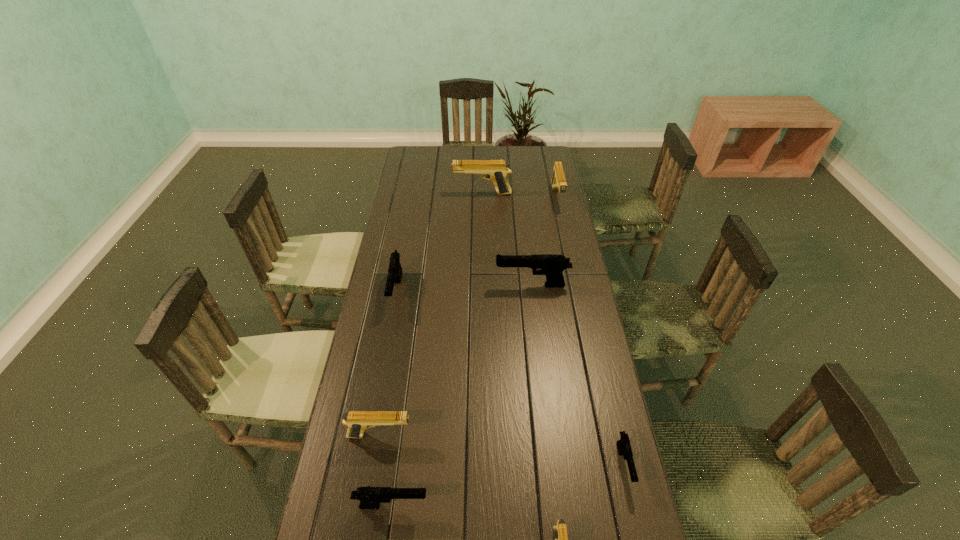
At what (x,y) coordinates should I click in order to perform the action: click on the third closest black pistol to the third tan pistol from right to left. Please return your answer as a coordinate pair (x, y). This screenshot has width=960, height=540. Looking at the image, I should click on (624, 447).

Find the location of a particular element. The width and height of the screenshot is (960, 540). vacant point that satisfies the following two spatial constraints: 1. at the barrel of the second object from right to left; 2. on the front-facing side of the biggest black pistol is located at coordinates (575, 285).

I want to click on vacant space that satisfies the following two spatial constraints: 1. on the front-facing side of the rightmost pistol; 2. on the front-facing side of the seventh farthest object, so click(633, 505).